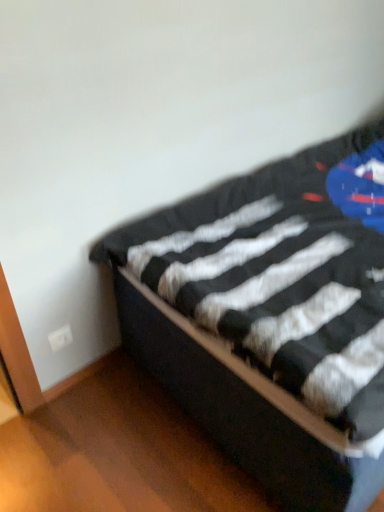
You are a GUI agent. You are given a task and a screenshot of the screen. Output one action in this format:
    pyautogui.click(x=<x>, y=<y>)
    Task: Click on the black textured bed at center
    
    Given the screenshot: What is the action you would take?
    pyautogui.click(x=270, y=315)

Image resolution: width=384 pixels, height=512 pixels. What do you see at coordinates (270, 315) in the screenshot? I see `black textured bed at center` at bounding box center [270, 315].

The height and width of the screenshot is (512, 384). Identify the location of black textured bed at center. (270, 315).